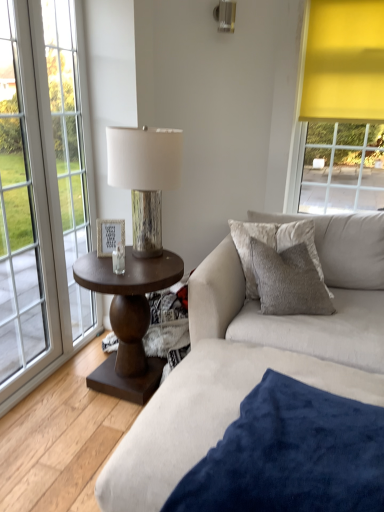
What is the approximate height of white wood picture frame at center?

It is 7.00 inches.

What do you see at coordinates (254, 358) in the screenshot?
I see `velvety blue blanket at lower right` at bounding box center [254, 358].

Find the location of a particular element. The width and height of the screenshot is (384, 512). dark wood side table at center is located at coordinates (128, 319).

What do you see at coordinates (145, 178) in the screenshot?
I see `wooden lampshade at center` at bounding box center [145, 178].

I want to click on wooden lampshade at center, so click(145, 178).

Measure the distance between white glass window at left and camera.

6.01 feet.

Locate an element on the screen. This screenshot has width=384, height=512. white wood picture frame at center is located at coordinates (109, 236).

Is white wood picture frame at center to the right of dark wood side table at center from the viewer's perspective?

Incorrect, white wood picture frame at center is not on the right side of dark wood side table at center.

Can you see white wood picture frame at center touching dark wood side table at center?

No, white wood picture frame at center is not in contact with dark wood side table at center.

Is white wood picture frame at center aimed at dark wood side table at center?

No, white wood picture frame at center is not turned towards dark wood side table at center.

Which object is wider, velvet gray pillow at center or white wood picture frame at center?

With larger width is velvet gray pillow at center.

Is velvet gray pillow at center next to white wood picture frame at center and touching it?

No, velvet gray pillow at center is not with white wood picture frame at center.

Based on their positions, is velvet gray pillow at center located to the left or right of white wood picture frame at center?

velvet gray pillow at center is positioned on white wood picture frame at center's right side.

Between white wood picture frame at center and velvety blue blanket at lower right, which one is positioned behind?

white wood picture frame at center is behind.

Does white wood picture frame at center have a lesser height compared to velvety blue blanket at lower right?

Indeed, white wood picture frame at center has a lesser height compared to velvety blue blanket at lower right.

Can you confirm if white wood picture frame at center is positioned to the right of velvety blue blanket at lower right?

In fact, white wood picture frame at center is to the left of velvety blue blanket at lower right.

Image resolution: width=384 pixels, height=512 pixels. What are the coordinates of `lamp above the white wood picture frame at center (from the image's perspective)` in the screenshot? It's located at (145, 178).

Can you confirm if white wood picture frame at center is bigger than wooden lampshade at center?

Actually, white wood picture frame at center might be smaller than wooden lampshade at center.

From a real-world perspective, is white wood picture frame at center on top of wooden lampshade at center?

No, from a real-world perspective, white wood picture frame at center is not over wooden lampshade at center

Considering the positions of objects white wood picture frame at center and wooden lampshade at center in the image provided, who is more to the right, white wood picture frame at center or wooden lampshade at center?

From the viewer's perspective, wooden lampshade at center appears more on the right side.

Which of these two, dark wood side table at center or velvet gray pillow at center, is smaller?

velvet gray pillow at center.

Is dark wood side table at center far from velvet gray pillow at center?

dark wood side table at center is near velvet gray pillow at center, not far away.

Locate an element on the screen. pillow behind the dark wood side table at center is located at coordinates (250, 248).

How many degrees apart are the facing directions of velvet gray pillow at center and textured beige couch at center?

The angular difference between velvet gray pillow at center and textured beige couch at center is 4.83 degrees.

Is velvet gray pillow at center next to textured beige couch at center?

velvet gray pillow at center and textured beige couch at center are not in contact.

Is velvet gray pillow at center to the left or to the right of textured beige couch at center in the image?

velvet gray pillow at center is positioned on textured beige couch at center's left side.

You are a GUI agent. You are given a task and a screenshot of the screen. Output one action in this format:
    pyautogui.click(x=<x>, y=<y>)
    Task: Click on the pillow that appears above the textured beige couch at center (from the image's perspective)
    This screenshot has width=384, height=512.
    Given the screenshot: What is the action you would take?
    pyautogui.click(x=250, y=248)

In terms of size, does wooden lampshade at center appear bigger or smaller than velvet gray pillow at center?

Clearly, wooden lampshade at center is larger in size than velvet gray pillow at center.

Is wooden lampshade at center oriented towards velvet gray pillow at center?

No, wooden lampshade at center is not facing towards velvet gray pillow at center.

From a real-world perspective, is wooden lampshade at center on velvet gray pillow at center?

Correct, in the physical world, wooden lampshade at center is higher than velvet gray pillow at center.

Identify the location of coffee table below the white wood picture frame at center (from the image's perspective). (128, 319).

Find the location of `picture frame that appears above the velvet gray pillow at center (from a real-world perspective)`. picture frame that appears above the velvet gray pillow at center (from a real-world perspective) is located at coordinates (109, 236).

Looking at this image, which object lies further to the anchor point textured beige couch at center, velvety blue blanket at lower right or white glass window at left?

white glass window at left lies further to textured beige couch at center than the other object.

Estimate the real-world distances between objects in this image. Which object is further from textured beige couch at center, velvety blue blanket at lower right or white wood picture frame at center?

white wood picture frame at center lies further to textured beige couch at center than the other object.

When comparing their distances from velvety blue blanket at lower right, does white wood picture frame at center or wooden lampshade at center seem further?

white wood picture frame at center is positioned further to the anchor velvety blue blanket at lower right.

Based on their spatial positions, is wooden lampshade at center or velvet gray pillow at center closer to textured beige couch at center?

Among the two, velvet gray pillow at center is located nearer to textured beige couch at center.

Estimate the real-world distances between objects in this image. Which object is further from white wood picture frame at center, wooden lampshade at center or velvety blue blanket at lower right?

velvety blue blanket at lower right.

When comparing their distances from velvet gray pillow at center, does white glass window at left or wooden lampshade at center seem further?

Among the two, white glass window at left is located further to velvet gray pillow at center.

Which object lies further to the anchor point dark wood side table at center, white wood picture frame at center or white glass window at left?

white glass window at left is positioned further to the anchor dark wood side table at center.

When comparing their distances from white glass window at left, does white wood picture frame at center or dark wood side table at center seem further?

The object further to white glass window at left is dark wood side table at center.

You are a GUI agent. You are given a task and a screenshot of the screen. Output one action in this format:
    pyautogui.click(x=<x>, y=<y>)
    Task: Click on the lamp between white glass window at left and white wood picture frame at center in the front-back direction
    This screenshot has width=384, height=512.
    Given the screenshot: What is the action you would take?
    pyautogui.click(x=145, y=178)

Locate an element on the screen. This screenshot has width=384, height=512. coffee table situated between white glass window at left and velvety blue blanket at lower right from left to right is located at coordinates (128, 319).

You are a GUI agent. You are given a task and a screenshot of the screen. Output one action in this format:
    pyautogui.click(x=<x>, y=<y>)
    Task: Click on the couch between velvety blue blanket at lower right and white wood picture frame at center in the front-back direction
    This screenshot has width=384, height=512.
    Given the screenshot: What is the action you would take?
    pyautogui.click(x=302, y=316)

You are a GUI agent. You are given a task and a screenshot of the screen. Output one action in this format:
    pyautogui.click(x=<x>, y=<y>)
    Task: Click on the lamp between white wood picture frame at center and velvet gray pillow at center from left to right
    
    Given the screenshot: What is the action you would take?
    pyautogui.click(x=145, y=178)